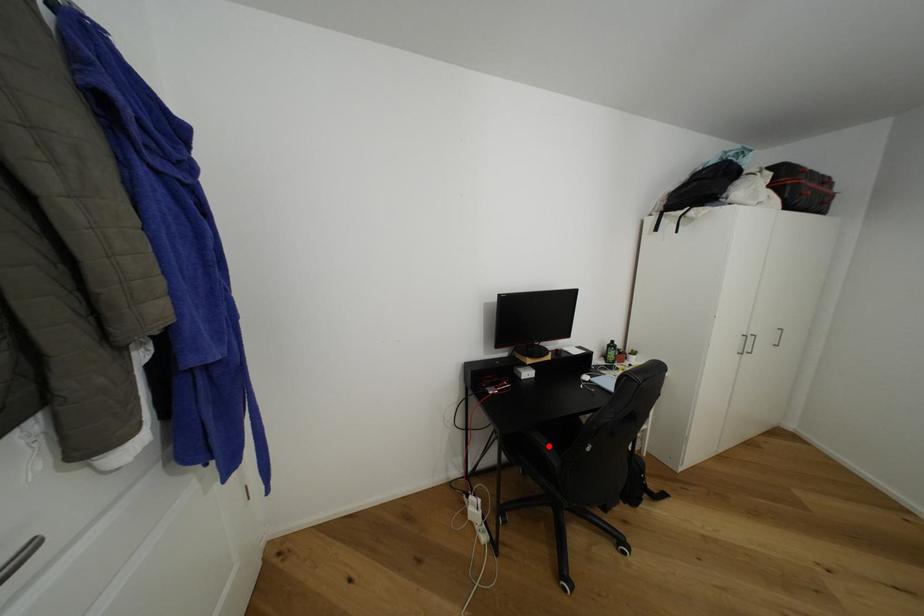
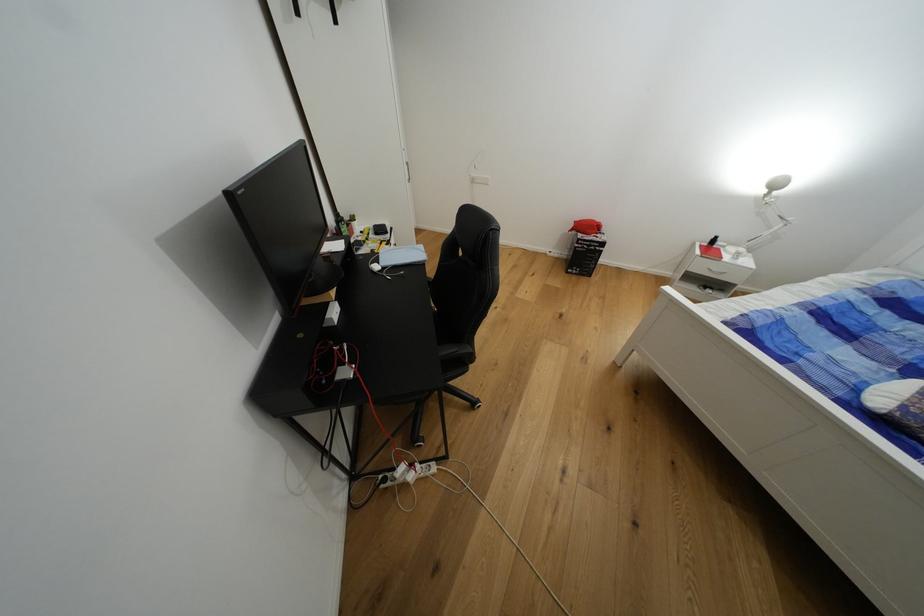
In the second image, find the point that corresponds to the highlighted location in the first image.

(460, 351)